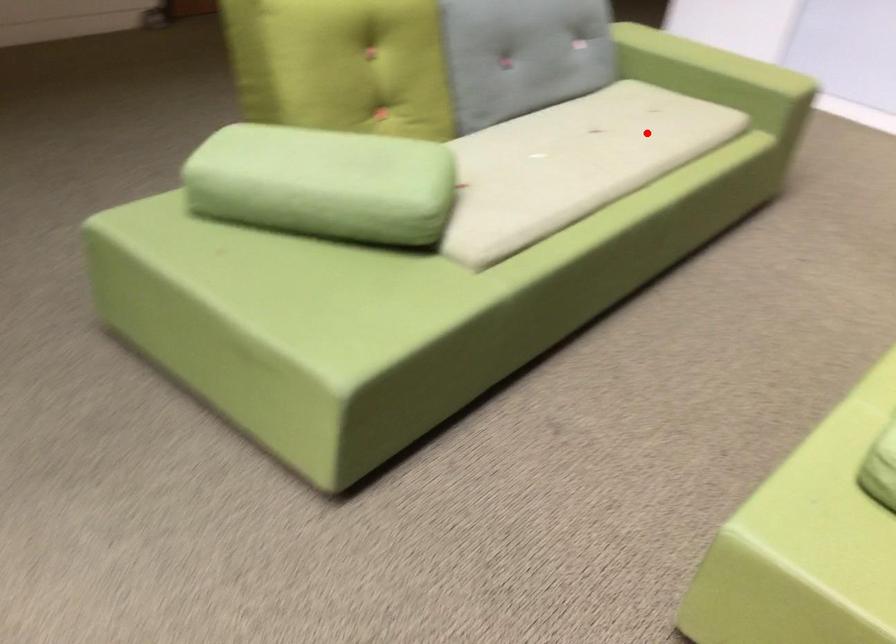
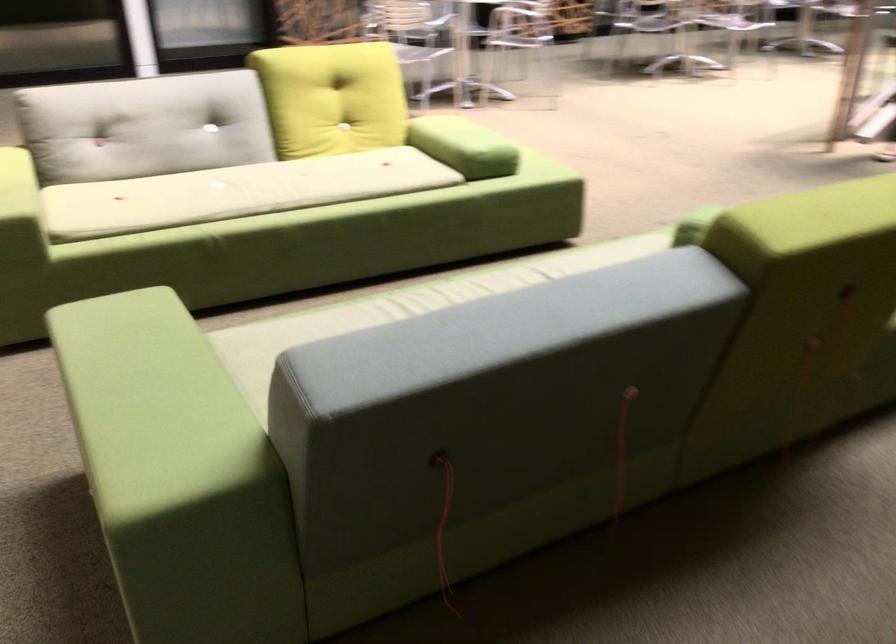
Question: I am providing you with two images of the same scene from different viewpoints. A red point is shown in image1. For the corresponding object point in image2, is it positioned nearer or farther from the camera?

Choices:
 (A) Nearer
 (B) Farther

Answer: (A)